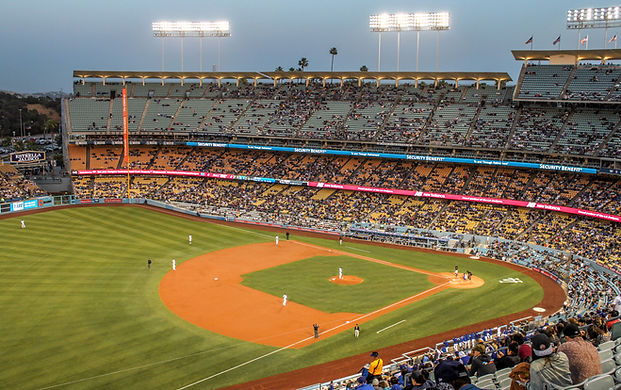
Where is `lights`? The image size is (621, 390). lights is located at coordinates (374, 25).